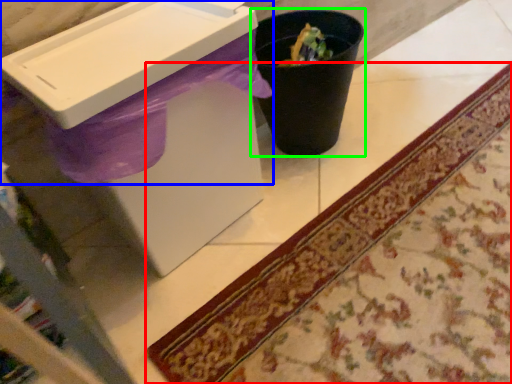
Question: Which object is positioned farthest from mat (highlighted by a red box)? Select from sink (highlighted by a blue box) and waste container (highlighted by a green box).

Choices:
 (A) sink
 (B) waste container

Answer: (A)